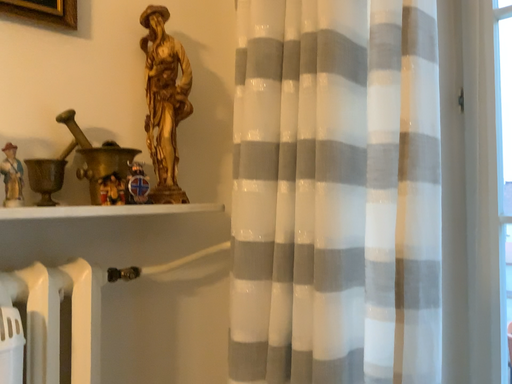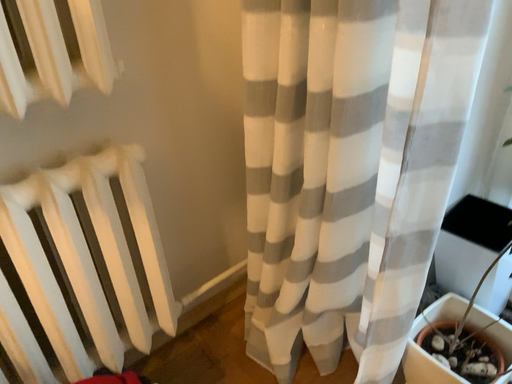
Question: Which way did the camera rotate in the video?

Choices:
 (A) rotated upward
 (B) rotated downward

Answer: (B)